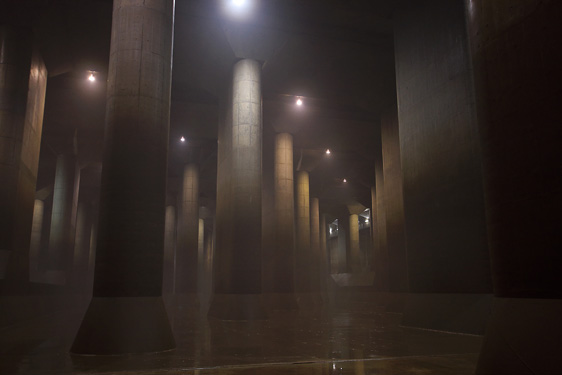
Where is `ceiling`? ceiling is located at coordinates (318, 46).